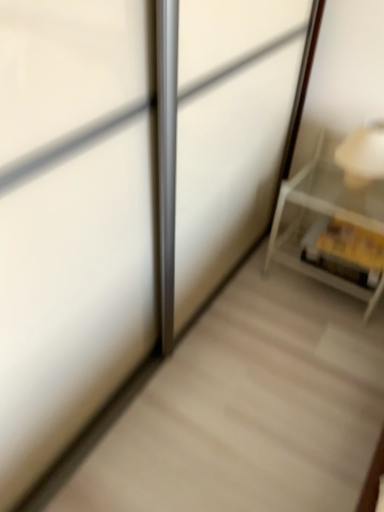
I want to click on vacant space in front of white glossy side table at right, so click(322, 344).